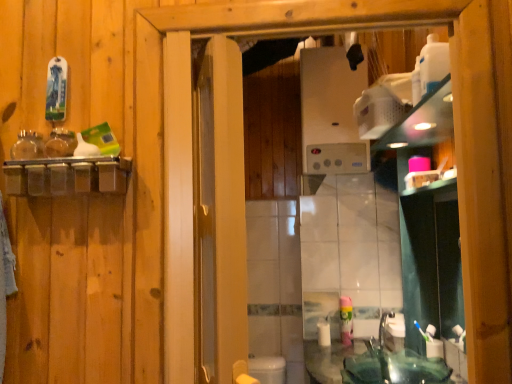
Find the location of a particular element. This screenshot has width=512, height=384. satin silver boiler at upper center is located at coordinates (329, 96).

What do you see at coordinates (346, 319) in the screenshot? I see `green plastic mouthwash at lower right` at bounding box center [346, 319].

Describe the element at coordinates (394, 368) in the screenshot. I see `green glass sink at lower right` at that location.

Describe the element at coordinates (324, 334) in the screenshot. I see `white matte toilet paper at lower center` at that location.

This screenshot has width=512, height=384. Describe the element at coordinates (433, 343) in the screenshot. I see `white plastic toothbrush at lower right` at that location.

Where is `satin silver boiler at upper center`? The width and height of the screenshot is (512, 384). satin silver boiler at upper center is located at coordinates pos(329,96).

Which is less distant, (433, 344) or (304, 97)?

Clearly, point (433, 344) is closer to the camera than point (304, 97).

From a real-world perspective, is white plastic toothbrush at lower right positioned under satin silver boiler at upper center based on gravity?

Indeed, from a real-world perspective, white plastic toothbrush at lower right is positioned beneath satin silver boiler at upper center.

Looking at this image, would you say white plastic toothbrush at lower right is a long distance from satin silver boiler at upper center?

white plastic toothbrush at lower right is far away from satin silver boiler at upper center.

Based on their sizes in the image, would you say white plastic toothbrush at lower right is bigger or smaller than satin silver boiler at upper center?

Considering their sizes, white plastic toothbrush at lower right takes up less space than satin silver boiler at upper center.

Find the location of a particular element. The image size is (512, 384). sink in front of the green plastic mouthwash at lower right is located at coordinates (394, 368).

Does green plastic mouthwash at lower right have a larger size compared to green glass sink at lower right?

No.

Is green glass sink at lower right surrounded by green plastic mouthwash at lower right?

No.

Is green glass sink at lower right to the left of white plastic toothbrush at lower right from the viewer's perspective?

Yes.

Considering the sizes of objects green glass sink at lower right and white plastic toothbrush at lower right in the image provided, who is bigger, green glass sink at lower right or white plastic toothbrush at lower right?

Bigger between the two is green glass sink at lower right.

Could you tell me if green glass sink at lower right is facing white plastic toothbrush at lower right?

No, green glass sink at lower right is not oriented towards white plastic toothbrush at lower right.

From the image's perspective, which is above, green glass sink at lower right or white plastic toothbrush at lower right?

white plastic toothbrush at lower right.

Is white matte toilet paper at lower center shorter than white plastic toothbrush at lower right?

Correct, white matte toilet paper at lower center is not as tall as white plastic toothbrush at lower right.

Based on the photo, considering the sizes of objects white matte toilet paper at lower center and white plastic toothbrush at lower right in the image provided, who is thinner, white matte toilet paper at lower center or white plastic toothbrush at lower right?

white plastic toothbrush at lower right.

In order to click on toiletry above the white matte toilet paper at lower center (from the image's perspective) in this screenshot , I will do `click(433, 343)`.

Which is in front, point (322, 322) or point (365, 67)?

Point (365, 67)

From a real-world perspective, which is physically below, white matte toilet paper at lower center or satin silver boiler at upper center?

white matte toilet paper at lower center.

Considering the positions of objects white matte toilet paper at lower center and satin silver boiler at upper center in the image provided, who is more to the left, white matte toilet paper at lower center or satin silver boiler at upper center?

Positioned to the left is white matte toilet paper at lower center.

Between satin silver boiler at upper center and green plastic mouthwash at lower right, which one appears on the right side from the viewer's perspective?

Positioned to the right is green plastic mouthwash at lower right.

Is satin silver boiler at upper center positioned with its back to green plastic mouthwash at lower right?

No.

Is the position of satin silver boiler at upper center less distant than that of green plastic mouthwash at lower right?

No, satin silver boiler at upper center is further to the viewer.

From a real-world perspective, is satin silver boiler at upper center physically located above or below green plastic mouthwash at lower right?

From a real-world perspective, satin silver boiler at upper center is physically above green plastic mouthwash at lower right.

Looking at this image, considering the sizes of objects green glass sink at lower right and green plastic mouthwash at lower right in the image provided, who is bigger, green glass sink at lower right or green plastic mouthwash at lower right?

Bigger between the two is green glass sink at lower right.

Is point (431, 381) behind point (349, 341)?

No, (431, 381) is in front of (349, 341).

Is green glass sink at lower right looking in the opposite direction of green plastic mouthwash at lower right?

No, green glass sink at lower right is not facing away from green plastic mouthwash at lower right.

Which of these two, green glass sink at lower right or green plastic mouthwash at lower right, is thinner?

Thinner between the two is green plastic mouthwash at lower right.

You are a GUI agent. You are given a task and a screenshot of the screen. Output one action in this format:
    pyautogui.click(x=<x>, y=<y>)
    Task: Click on the toiletry in front of the satin silver boiler at upper center
    This screenshot has width=512, height=384.
    Given the screenshot: What is the action you would take?
    pyautogui.click(x=433, y=343)

Image resolution: width=512 pixels, height=384 pixels. In order to click on mouthwash on the left of green glass sink at lower right in this screenshot , I will do `click(346, 319)`.

When comparing their distances from white plastic toothbrush at lower right, does satin silver boiler at upper center or white matte toilet paper at lower center seem closer?

white matte toilet paper at lower center is positioned closer to the anchor white plastic toothbrush at lower right.

From the image, which object appears to be nearer to green glass sink at lower right, satin silver boiler at upper center or white matte toilet paper at lower center?

Among the two, white matte toilet paper at lower center is located nearer to green glass sink at lower right.

Estimate the real-world distances between objects in this image. Which object is further from white plastic toothbrush at lower right, green plastic mouthwash at lower right or green glass sink at lower right?

The object further to white plastic toothbrush at lower right is green plastic mouthwash at lower right.

Considering their positions, is green plastic mouthwash at lower right positioned further to green glass sink at lower right than white matte toilet paper at lower center?

The object further to green glass sink at lower right is white matte toilet paper at lower center.

When comparing their distances from white matte toilet paper at lower center, does green glass sink at lower right or satin silver boiler at upper center seem further?

satin silver boiler at upper center lies further to white matte toilet paper at lower center than the other object.

Based on their spatial positions, is white matte toilet paper at lower center or white plastic toothbrush at lower right closer to satin silver boiler at upper center?

white matte toilet paper at lower center lies closer to satin silver boiler at upper center than the other object.

Which object lies further to the anchor point white matte toilet paper at lower center, satin silver boiler at upper center or green plastic mouthwash at lower right?

satin silver boiler at upper center is further to white matte toilet paper at lower center.

Consider the image. Looking at the image, which one is located further to white matte toilet paper at lower center, green plastic mouthwash at lower right or green glass sink at lower right?

Based on the image, green glass sink at lower right appears to be further to white matte toilet paper at lower center.

Locate an element on the screen. The height and width of the screenshot is (384, 512). toiletry between green glass sink at lower right and white matte toilet paper at lower center in the front-back direction is located at coordinates (433, 343).

Locate an element on the screen. Image resolution: width=512 pixels, height=384 pixels. mouthwash located between white matte toilet paper at lower center and white plastic toothbrush at lower right in the left-right direction is located at coordinates (346, 319).

Where is `toilet paper located between green glass sink at lower right and green plastic mouthwash at lower right in the depth direction`? toilet paper located between green glass sink at lower right and green plastic mouthwash at lower right in the depth direction is located at coordinates (324, 334).

Identify the location of toilet paper between satin silver boiler at upper center and green glass sink at lower right from top to bottom. This screenshot has width=512, height=384. (324, 334).